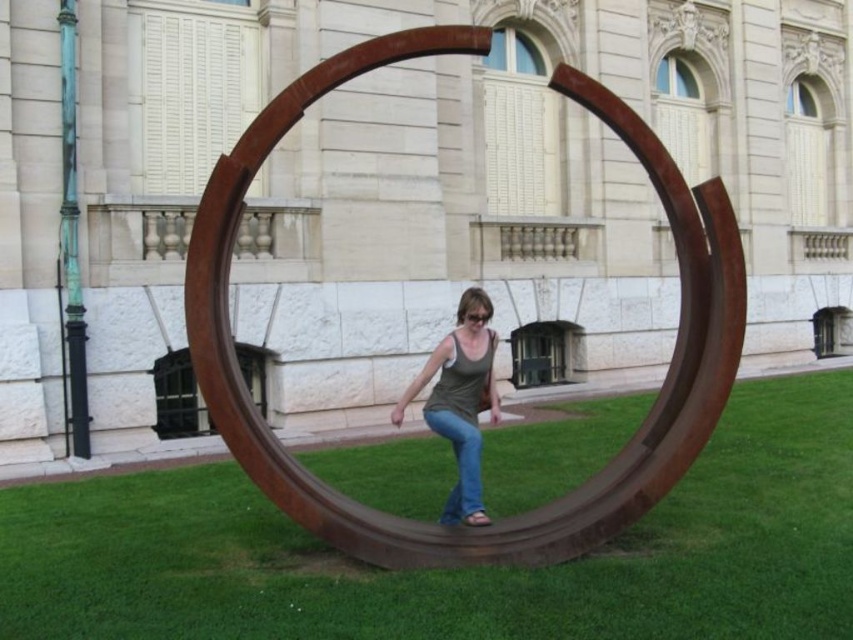
Does green grass at center appear on the right side of matte gray tank top at center?

Yes, green grass at center is to the right of matte gray tank top at center.

Does point (314, 611) come behind point (492, 356)?

No, (314, 611) is in front of (492, 356).

You are a GUI agent. You are given a task and a screenshot of the screen. Output one action in this format:
    pyautogui.click(x=<x>, y=<y>)
    Task: Click on the green grass at center
    
    Given the screenshot: What is the action you would take?
    pyautogui.click(x=460, y=568)

Which of these two, matte gray tank top at center or jeans at center, stands shorter?

jeans at center is shorter.

Is matte gray tank top at center to the right of jeans at center from the viewer's perspective?

No, matte gray tank top at center is not to the right of jeans at center.

Who is more distant from viewer, (482, 384) or (427, 426)?

Positioned behind is point (427, 426).

Where is `matte gray tank top at center`? This screenshot has height=640, width=853. matte gray tank top at center is located at coordinates (460, 401).

Is rusty metal circle at center taller than matte gray tank top at center?

No, rusty metal circle at center is not taller than matte gray tank top at center.

Where is `rusty metal circle at center`? The height and width of the screenshot is (640, 853). rusty metal circle at center is located at coordinates (587, 480).